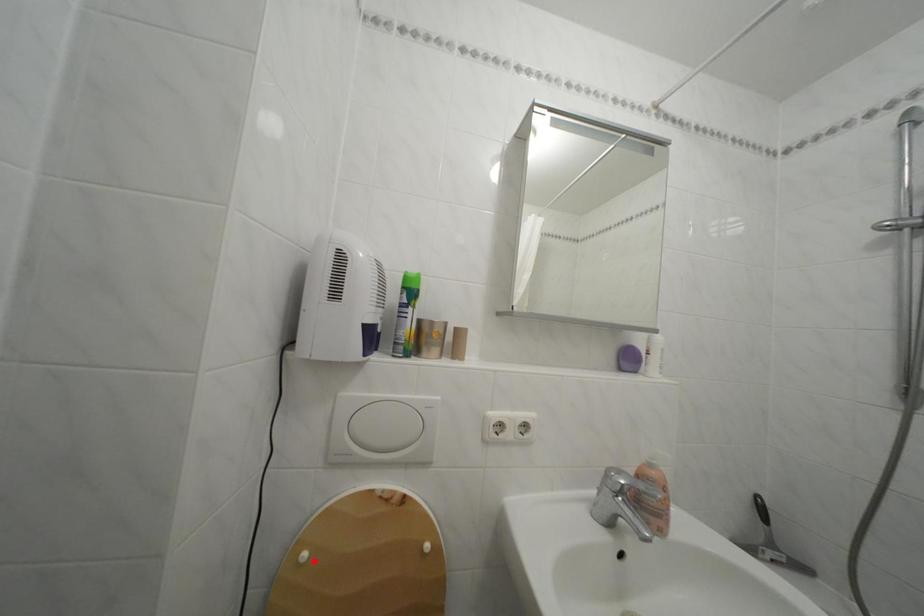
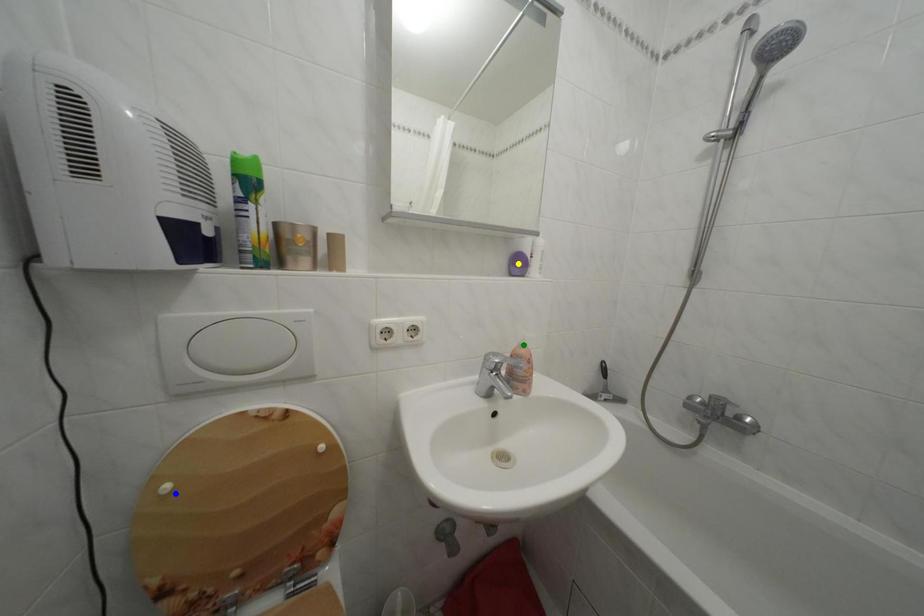
Question: I am providing you with two images of the same scene from different viewpoints. A red point is marked on the first image. You are given multiple points on the second image. Which spot in image 2 lines up with the point in image 1?

Choices:
 (A) yellow point
 (B) green point
 (C) blue point

Answer: (C)